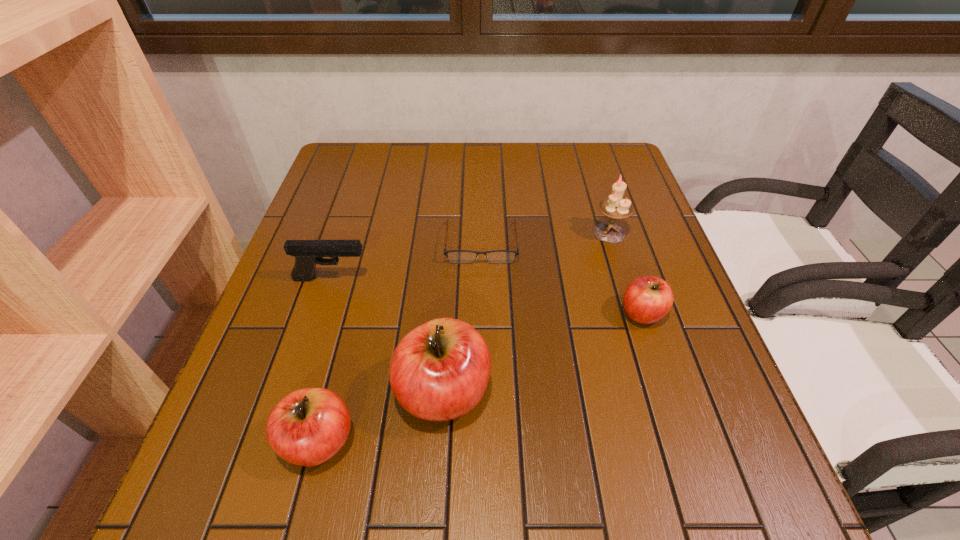
You are a GUI agent. You are given a task and a screenshot of the screen. Output one action in this format:
    pyautogui.click(x=<x>, y=<y>)
    Task: Click on the free space located 0.070m on the front-facing side of the fourth nearest object
    This screenshot has height=540, width=960.
    Given the screenshot: What is the action you would take?
    pyautogui.click(x=401, y=279)

Locate an element on the screen. Image resolution: width=960 pixels, height=540 pixels. free space located on the front-facing side of the shortest object is located at coordinates (481, 293).

At what (x,y) coordinates should I click in order to perform the action: click on vacant region located 0.150m on the left of the candle holder. Please return your answer as a coordinate pair (x, y). This screenshot has height=540, width=960. Looking at the image, I should click on (534, 233).

The image size is (960, 540). I want to click on apple present at the left edge, so click(x=307, y=427).

Identify the location of pistol that is at the left edge. The image size is (960, 540). (307, 253).

Locate an element on the screen. apple that is positioned at the right edge is located at coordinates 647,299.

Image resolution: width=960 pixels, height=540 pixels. Identify the location of candle holder situated at the right edge. (614, 207).

What are the coordinates of `object located at the near left corner` in the screenshot? It's located at (307, 427).

Where is `vacant space at the far edge of the desktop`? vacant space at the far edge of the desktop is located at coordinates (461, 151).

Image resolution: width=960 pixels, height=540 pixels. What are the coordinates of `free space at the near edge of the desktop` in the screenshot? It's located at (649, 442).